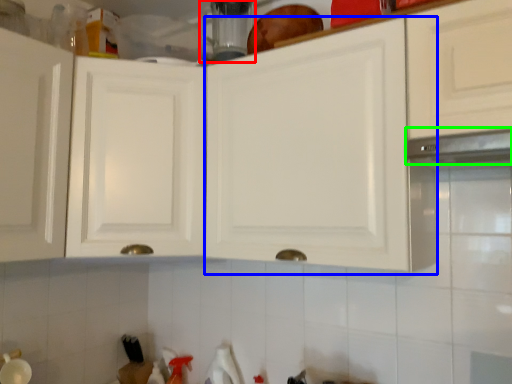
Question: Considering the real-world distances, which object is farthest from appliance (highlighted by a red box)? cabinetry (highlighted by a blue box) or exhaust hood (highlighted by a green box)?

Choices:
 (A) cabinetry
 (B) exhaust hood

Answer: (B)